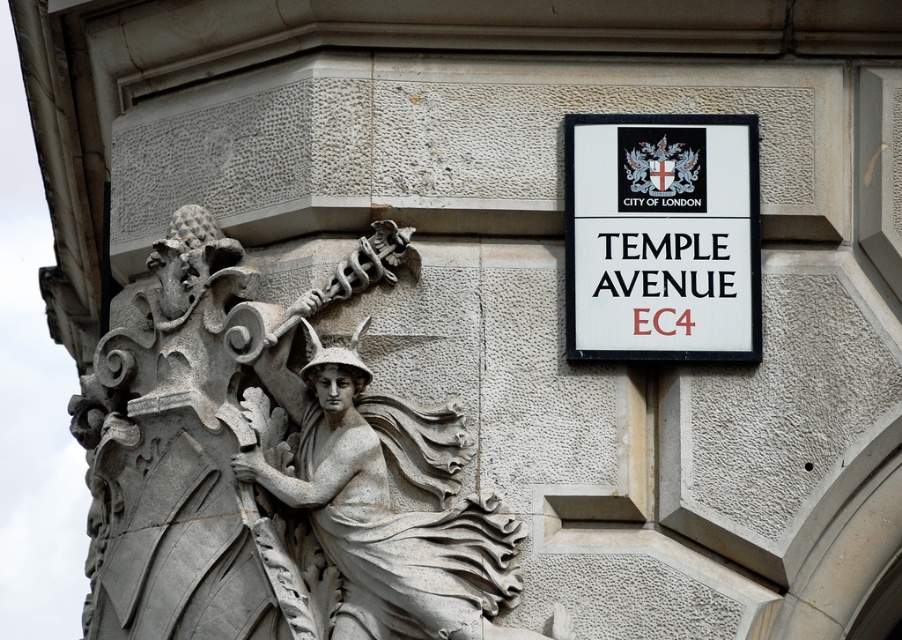
Question: Which object is the farthest from the white plastic sign at upper center?

Choices:
 (A) white stone sculpture at upper left
 (B) white stone angel at center

Answer: (A)

Question: Is white stone sculpture at upper left above white plastic sign at upper center?

Choices:
 (A) no
 (B) yes

Answer: (A)

Question: Based on their relative distances, which object is farther from the white stone sculpture at upper left?

Choices:
 (A) white plastic sign at upper center
 (B) white stone angel at center

Answer: (A)

Question: Which point is farther to the camera?

Choices:
 (A) white stone angel at center
 (B) white stone sculpture at upper left

Answer: (A)

Question: Is white stone sculpture at upper left in front of white plastic sign at upper center?

Choices:
 (A) no
 (B) yes

Answer: (B)

Question: Is white stone sculpture at upper left wider than white stone angel at center?

Choices:
 (A) yes
 (B) no

Answer: (A)